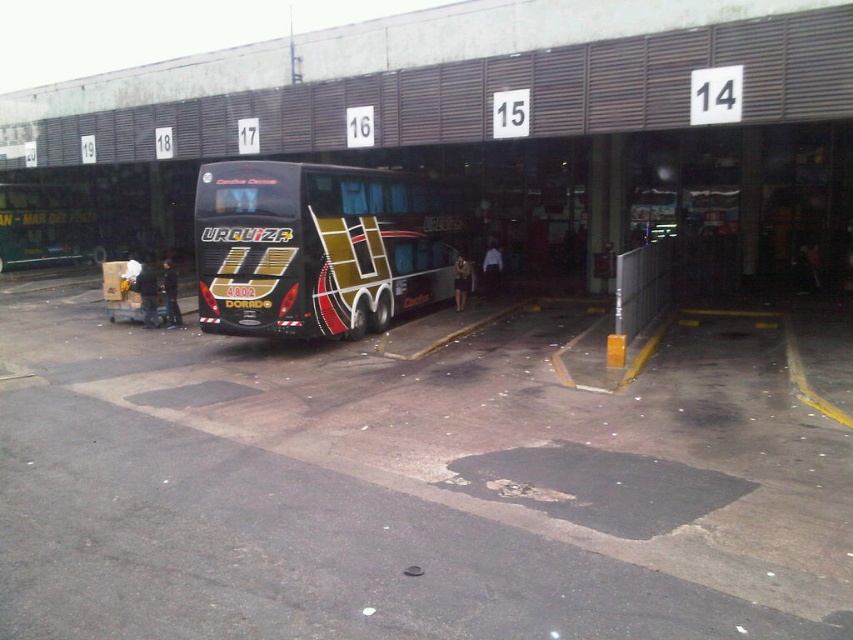
You are a bus driver who just arrived at the terminal. You need to park your bus in stall number 14. The terminal has a shiny metallic bus at center and a metallic gold bus at center. Which bus should you avoid parking next to to ensure there is enough space?

The shiny metallic bus at center is larger in size than the metallic gold bus at center, so you should avoid parking next to the shiny metallic bus at center to ensure there is enough space.

You are standing at the terminal entrance of stall number 14. You see two buses in front of you, the metallic bus at center and the metallic gold bus at center. Which one is closer to you?

The metallic bus at center is closer to the viewer than the metallic gold bus at center.